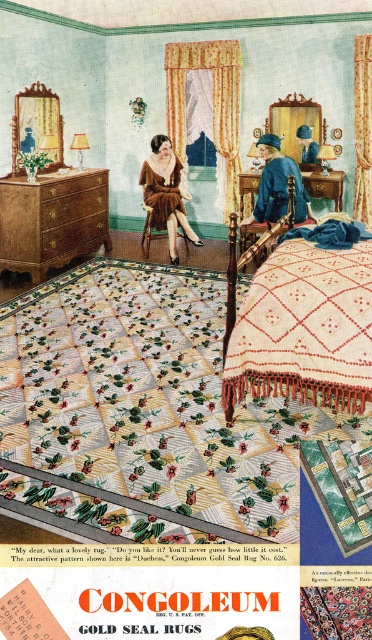
Question: Which point is closer to the camera taking this photo?

Choices:
 (A) (263, 144)
 (B) (299, 241)
 (C) (209, 380)
 (D) (168, 198)

Answer: (C)

Question: Is printed cotton quilt at center thinner than blue velvet dress at center?

Choices:
 (A) yes
 (B) no

Answer: (B)

Question: Which point is farther to the camera?

Choices:
 (A) blue velvet dress at center
 (B) white knitted blanket at center
 (C) printed cotton quilt at center
 (D) fuzzy brown fur coat at center

Answer: (D)

Question: Which object is the farthest from the printed cotton quilt at center?

Choices:
 (A) wooden dresser at left
 (B) fuzzy brown fur coat at center

Answer: (B)

Question: Does printed cotton quilt at center have a lesser width compared to blue velvet dress at center?

Choices:
 (A) yes
 (B) no

Answer: (B)

Question: Can you confirm if printed cotton quilt at center is bigger than white knitted blanket at center?

Choices:
 (A) yes
 (B) no

Answer: (A)